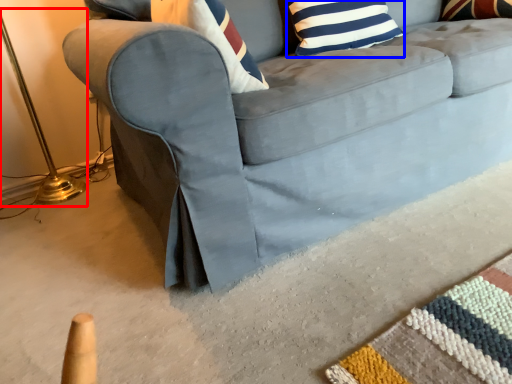
Question: Among these objects, which one is farthest to the camera, table lamp (highlighted by a red box) or pillow (highlighted by a blue box)?

Choices:
 (A) table lamp
 (B) pillow

Answer: (B)